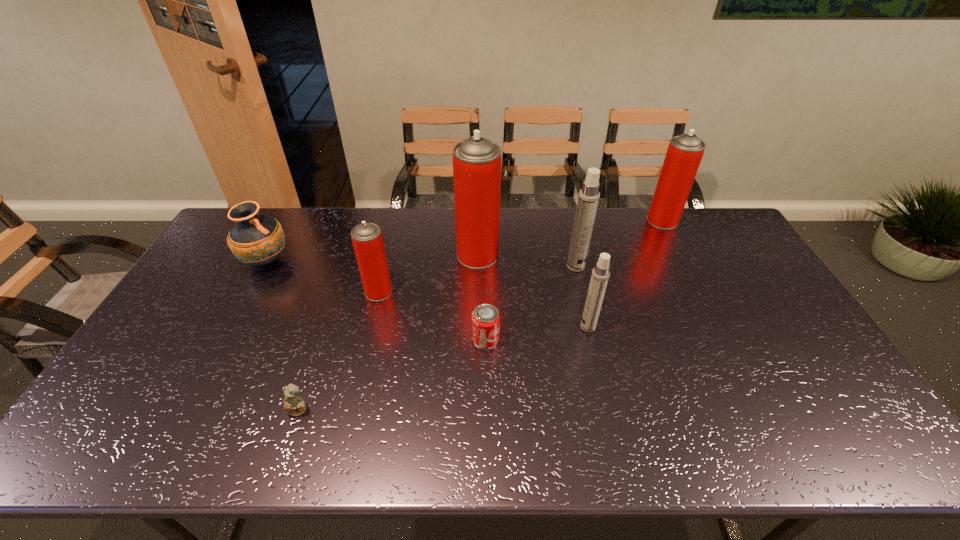
What are the coordinates of `pottery` in the screenshot? It's located at (256, 239).

At what (x,y) coordinates should I click in order to perform the action: click on can. Please return your answer as a coordinate pair (x, y). This screenshot has width=960, height=540. Looking at the image, I should click on (485, 318).

This screenshot has height=540, width=960. In order to click on red can in this screenshot , I will do `click(485, 318)`.

Find the location of a particular element. This screenshot has height=540, width=960. the seventh object from right to left is located at coordinates (295, 405).

The height and width of the screenshot is (540, 960). Identify the location of the shortest object. (295, 405).

Find the location of a particular element. The width and height of the screenshot is (960, 540). free spot located on the right of the tallest aerosol can is located at coordinates (537, 255).

The image size is (960, 540). I want to click on blank space located 0.140m on the left of the rightmost aerosol can, so click(611, 220).

Where is `vacant space located 0.270m on the front of the farther white aerosol can`? The image size is (960, 540). vacant space located 0.270m on the front of the farther white aerosol can is located at coordinates (592, 336).

The width and height of the screenshot is (960, 540). Find the location of `free space located 0.360m on the right of the leftmost aerosol can`. free space located 0.360m on the right of the leftmost aerosol can is located at coordinates (507, 292).

Image resolution: width=960 pixels, height=540 pixels. In order to click on vacant space located 0.270m on the front of the nearest aerosol can in this screenshot , I will do `click(610, 419)`.